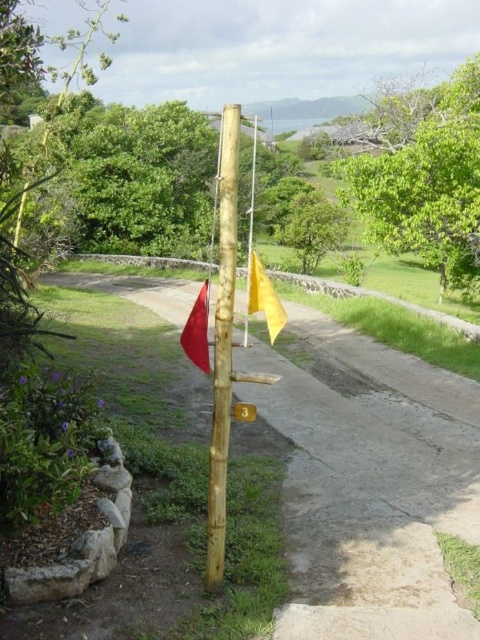
Can you confirm if green leafy tree at center is positioned below smooth red flag at left?

No.

Who is positioned more to the left, green leafy tree at center or smooth red flag at left?

Positioned to the left is smooth red flag at left.

Does point (284, 237) lie in front of point (204, 330)?

No, (284, 237) is further to viewer.

Find the location of a particular element. green leafy tree at center is located at coordinates (311, 227).

Is natural wood pole at center wider than smooth red flag at left?

No.

Is natural wood pole at center smaller than smooth red flag at left?

Incorrect, natural wood pole at center is not smaller in size than smooth red flag at left.

Where is `natural wood pole at center`? natural wood pole at center is located at coordinates (223, 342).

The image size is (480, 640). What do you see at coordinates (264, 298) in the screenshot?
I see `yellow matte flag at center` at bounding box center [264, 298].

Is point (248, 284) closer to camera compared to point (204, 328)?

No.

This screenshot has height=640, width=480. Identify the location of yellow matte flag at center. (264, 298).